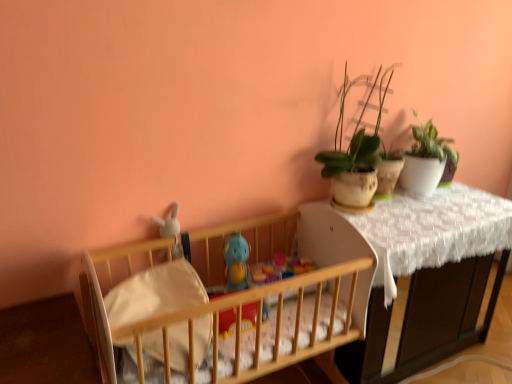
Question: From the image's perspective, would you say blue rubber duck at center, which ranks as the first toy in right-to-left order, is positioned over matte clay pot at upper right, the first houseplant positioned from the left?

Choices:
 (A) no
 (B) yes

Answer: (A)

Question: Is blue rubber duck at center, which ranks as the first toy in right-to-left order, turned away from matte clay pot at upper right, the first houseplant positioned from the left?

Choices:
 (A) yes
 (B) no

Answer: (B)

Question: From a real-world perspective, is blue rubber duck at center, which ranks as the first toy in right-to-left order, on matte clay pot at upper right, the first houseplant positioned from the left?

Choices:
 (A) yes
 (B) no

Answer: (B)

Question: Considering the relative sizes of blue rubber duck at center, positioned as the second toy in left-to-right order, and matte clay pot at upper right, the first houseplant positioned from the left, in the image provided, is blue rubber duck at center, positioned as the second toy in left-to-right order, wider than matte clay pot at upper right, the first houseplant positioned from the left,?

Choices:
 (A) yes
 (B) no

Answer: (B)

Question: Is blue rubber duck at center, positioned as the second toy in left-to-right order, outside of matte clay pot at upper right, the first houseplant positioned from the left?

Choices:
 (A) yes
 (B) no

Answer: (A)

Question: Is blue rubber duck at center, which ranks as the first toy in right-to-left order, bigger than matte clay pot at upper right, placed as the second houseplant when sorted from right to left?

Choices:
 (A) no
 (B) yes

Answer: (A)

Question: Is white soft crib sheet at center placed right next to blue rubber duck at center, positioned as the second toy in left-to-right order?

Choices:
 (A) no
 (B) yes

Answer: (A)

Question: Is white soft crib sheet at center aimed at blue rubber duck at center, which ranks as the first toy in right-to-left order?

Choices:
 (A) yes
 (B) no

Answer: (B)

Question: From a real-world perspective, is white soft crib sheet at center positioned under blue rubber duck at center, which ranks as the first toy in right-to-left order, based on gravity?

Choices:
 (A) yes
 (B) no

Answer: (B)

Question: Considering the relative sizes of white soft crib sheet at center and blue rubber duck at center, which ranks as the first toy in right-to-left order, in the image provided, is white soft crib sheet at center taller than blue rubber duck at center, which ranks as the first toy in right-to-left order,?

Choices:
 (A) yes
 (B) no

Answer: (B)

Question: Can you confirm if white soft crib sheet at center is shorter than blue rubber duck at center, which ranks as the first toy in right-to-left order?

Choices:
 (A) no
 (B) yes

Answer: (B)

Question: Can you confirm if white soft crib sheet at center is thinner than blue rubber duck at center, which ranks as the first toy in right-to-left order?

Choices:
 (A) no
 (B) yes

Answer: (A)

Question: Is white plush rabbit at left, the second toy positioned from the right, closer to the viewer compared to wooden crib at left?

Choices:
 (A) yes
 (B) no

Answer: (B)